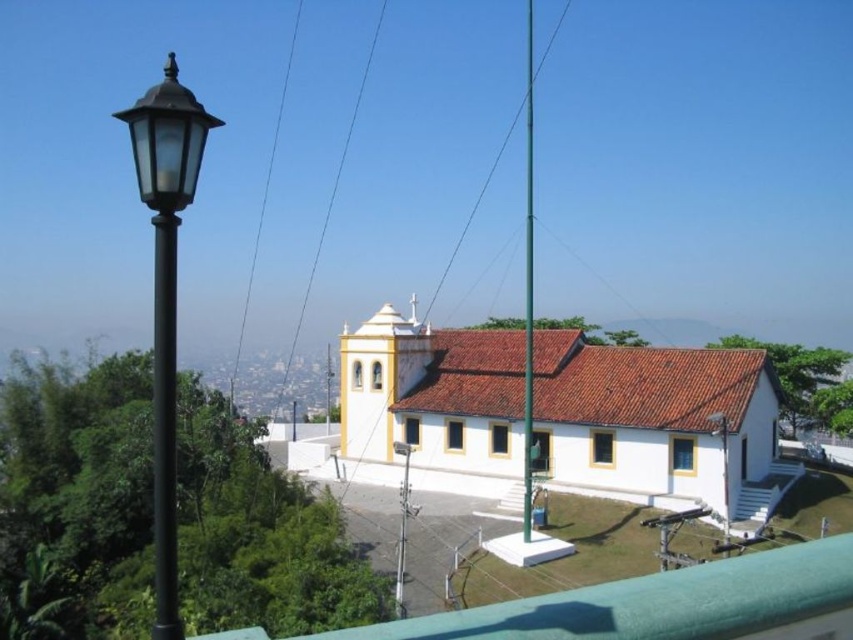
Question: Is black matte street light at left thinner than silver metallic street light at center?

Choices:
 (A) yes
 (B) no

Answer: (B)

Question: Where is black matte street light at left located in relation to silver metallic street light at center in the image?

Choices:
 (A) above
 (B) below

Answer: (A)

Question: Which point appears farthest from the camera in this image?

Choices:
 (A) (724, 483)
 (B) (399, 561)
 (C) (155, 250)

Answer: (A)

Question: Which point appears farthest from the camera in this image?

Choices:
 (A) (163, 470)
 (B) (532, 330)

Answer: (B)

Question: Does black matte street light at left have a larger size compared to green metallic pole at center?

Choices:
 (A) yes
 (B) no

Answer: (A)

Question: Which of the following is the closest to the observer?

Choices:
 (A) (525, 403)
 (B) (726, 444)
 (C) (173, 540)

Answer: (C)